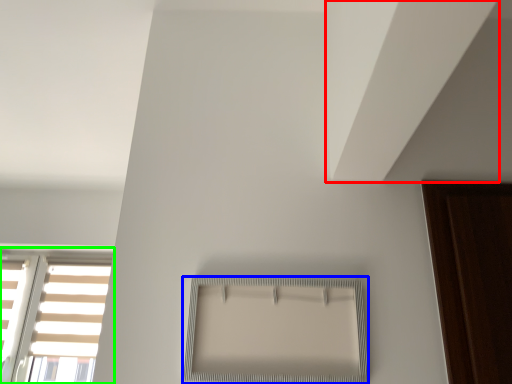
Question: Which is farther away from blind (highlighted by a red box)? window (highlighted by a blue box) or window (highlighted by a green box)?

Choices:
 (A) window
 (B) window

Answer: (B)